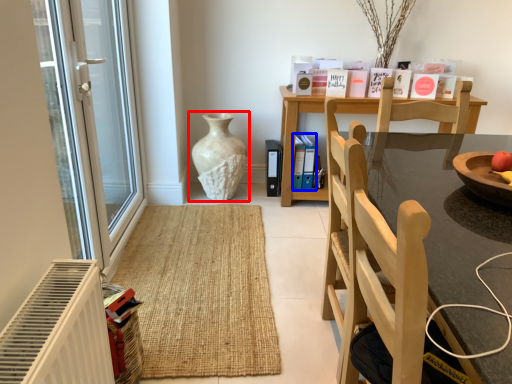
Question: Which of the following is the farthest to the observer, vase (highlighted by a red box) or book (highlighted by a blue box)?

Choices:
 (A) vase
 (B) book

Answer: (B)